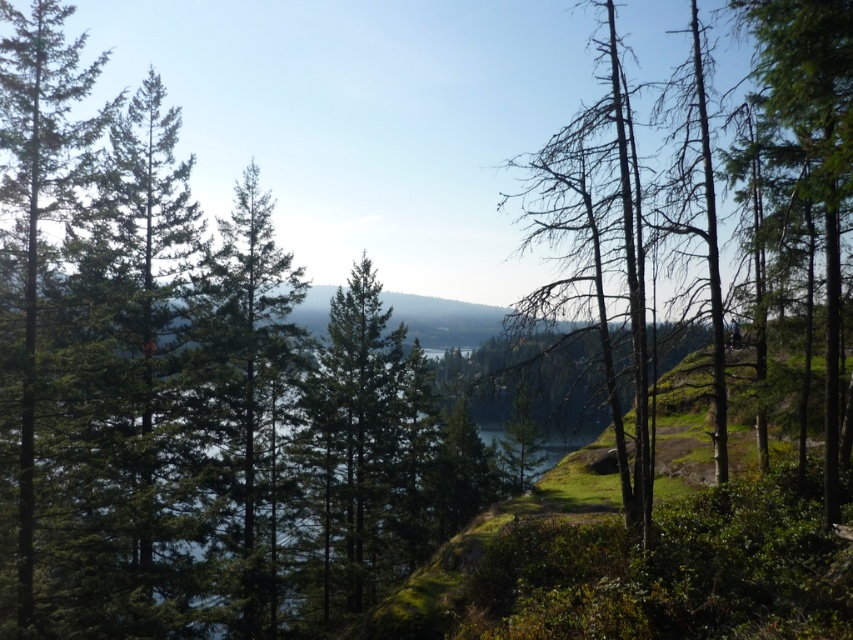
You are standing at the center of the scene. Which direction should you look to see the green matte tree at left?

The green matte tree at left is located at point coordinates of (x=38, y=196), so you should look to your left to see it.

You are standing in the natural landscape and want to walk from the green matte tree at left to the green matte tree at center. Which direction should you move relative to the trees?

To move from the green matte tree at left to the green matte tree at center, you should move downward since the green matte tree at center is below the green matte tree at left.